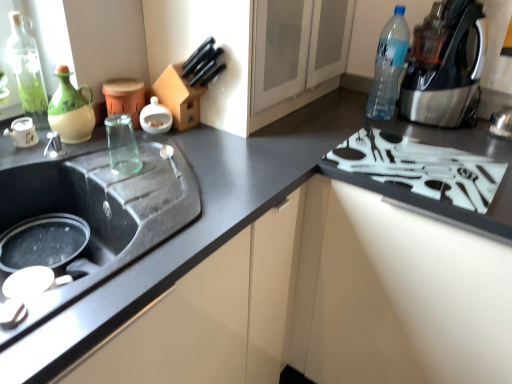
Question: Would you say green glass bottle at upper left, the 1th bottle positioned from the left, is outside matte glass jar at upper left, arranged as the 2th appliance when viewed from the left?

Choices:
 (A) no
 (B) yes

Answer: (B)

Question: Can you confirm if green glass bottle at upper left, the second bottle from the right, is shorter than matte glass jar at upper left, arranged as the 2th appliance when viewed from the left?

Choices:
 (A) no
 (B) yes

Answer: (A)

Question: Is green glass bottle at upper left, the second bottle from the right, turned away from matte glass jar at upper left, acting as the 2th appliance starting from the right?

Choices:
 (A) no
 (B) yes

Answer: (A)

Question: Are green glass bottle at upper left, the second bottle from the right, and matte glass jar at upper left, arranged as the 2th appliance when viewed from the left, beside each other?

Choices:
 (A) yes
 (B) no

Answer: (B)

Question: From a real-world perspective, does green glass bottle at upper left, the second bottle from the right, sit lower than matte glass jar at upper left, acting as the 2th appliance starting from the right?

Choices:
 (A) no
 (B) yes

Answer: (A)

Question: In terms of width, does white matte teapot at left, marked as the first appliance in a left-to-right arrangement, look wider or thinner when compared to blue plastic bottle at upper right, placed as the 2th bottle when sorted from left to right?

Choices:
 (A) wide
 (B) thin

Answer: (B)

Question: Considering the positions of point (31, 120) and point (393, 81), is point (31, 120) closer or farther from the camera than point (393, 81)?

Choices:
 (A) farther
 (B) closer

Answer: (B)

Question: Choose the correct answer: Is white matte teapot at left, marked as the first appliance in a left-to-right arrangement, inside blue plastic bottle at upper right, placed as the 2th bottle when sorted from left to right, or outside it?

Choices:
 (A) outside
 (B) inside

Answer: (A)

Question: From a real-world perspective, relative to blue plastic bottle at upper right, the 1th bottle in the right-to-left sequence, is white matte teapot at left, placed as the third appliance when sorted from right to left, vertically above or below?

Choices:
 (A) above
 (B) below

Answer: (B)

Question: Looking at the image, does white plastic gas stove at right seem bigger or smaller compared to green matte teapot at left?

Choices:
 (A) big
 (B) small

Answer: (A)

Question: Relative to green matte teapot at left, is white plastic gas stove at right in front or behind?

Choices:
 (A) front
 (B) behind

Answer: (A)

Question: From a real-world perspective, is white plastic gas stove at right physically located above or below green matte teapot at left?

Choices:
 (A) below
 (B) above

Answer: (A)

Question: Looking at their shapes, would you say white plastic gas stove at right is wider or thinner than green matte teapot at left?

Choices:
 (A) thin
 (B) wide

Answer: (B)

Question: From the image's perspective, is white plastic gas stove at right above or below matte glass jar at upper left, acting as the 2th appliance starting from the right?

Choices:
 (A) below
 (B) above

Answer: (A)

Question: From a real-world perspective, is white plastic gas stove at right above or below matte glass jar at upper left, acting as the 2th appliance starting from the right?

Choices:
 (A) below
 (B) above

Answer: (A)